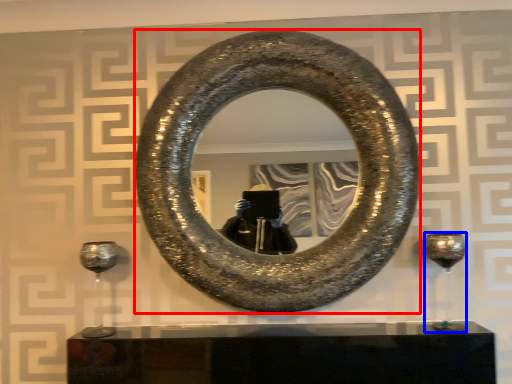
Question: Which point is closer to the camera, horseshoe (highlighted by a red box) or wine glass (highlighted by a blue box)?

Choices:
 (A) horseshoe
 (B) wine glass

Answer: (A)